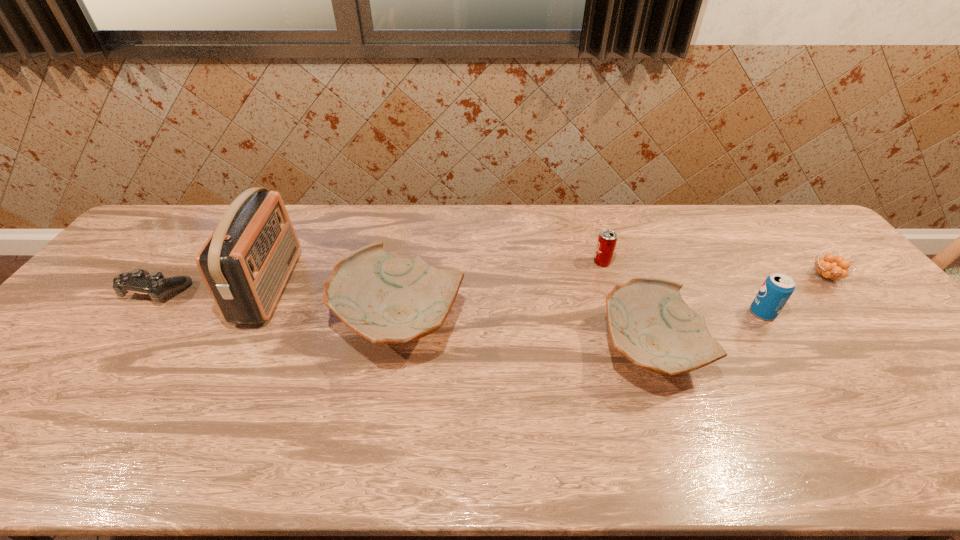
In the image, there is a desktop. Where is `vacant space at the near edge`? The height and width of the screenshot is (540, 960). vacant space at the near edge is located at coordinates (252, 393).

In the image, there is a desktop. Where is `vacant space at the left edge`? This screenshot has width=960, height=540. vacant space at the left edge is located at coordinates (96, 324).

The width and height of the screenshot is (960, 540). Identify the location of vacant space at the right edge of the desktop. tap(847, 329).

Identify the location of free space at the far left corner of the desktop. (170, 210).

In order to click on vacant space at the far right corner in this screenshot , I will do (x=784, y=245).

Where is `vacant point located between the taller pottery and the right pottery`? The image size is (960, 540). vacant point located between the taller pottery and the right pottery is located at coordinates (524, 336).

The width and height of the screenshot is (960, 540). I want to click on free point between the right pottery and the tallest object, so click(460, 318).

Locate an element on the screen. vacant area that lies between the second object from left to right and the shorter pottery is located at coordinates (460, 318).

At what (x,y) coordinates should I click in order to perform the action: click on vacant space in between the beer can and the left pottery. Please return your answer as a coordinate pair (x, y). The width and height of the screenshot is (960, 540). Looking at the image, I should click on (501, 292).

Identify the location of vacant point located between the control and the taller pottery. The height and width of the screenshot is (540, 960). (279, 306).